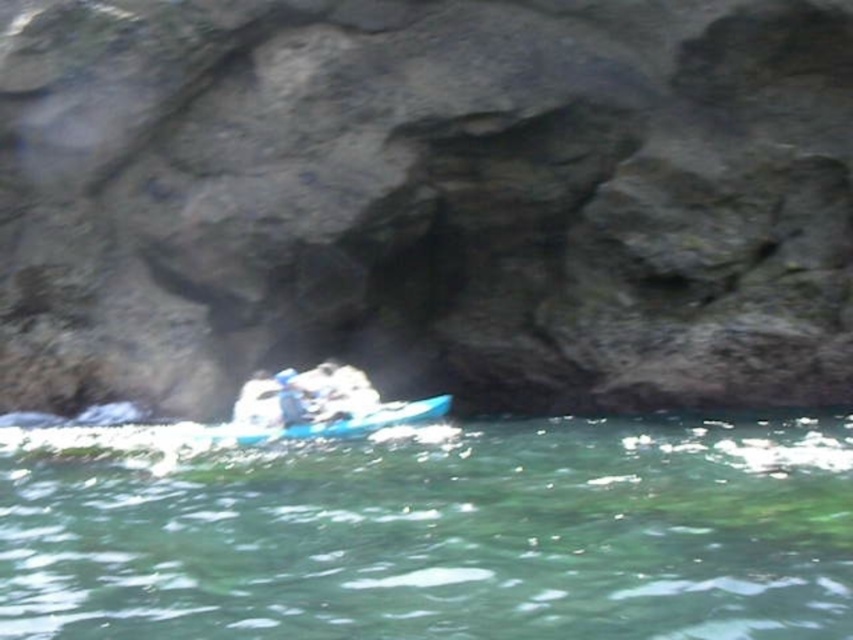
You are a photographer planning to capture the black rock at center and the green translucent water at center in a single shot. Given that the camera can only focus on one object clearly, which object should you prioritize focusing on to ensure the larger one is sharp?

The black rock at center is larger in size than the green translucent water at center, so you should prioritize focusing on the black rock at center to ensure the larger object is sharp.